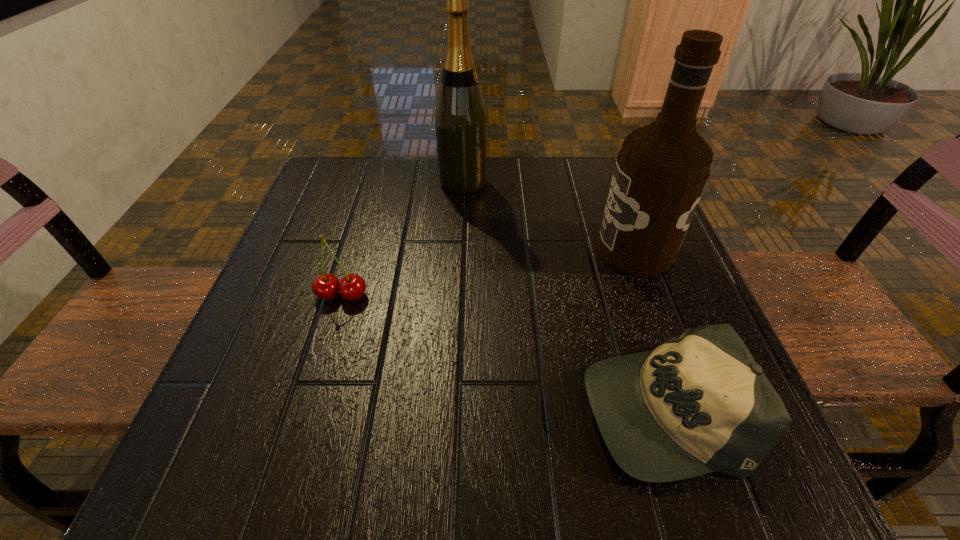
Image resolution: width=960 pixels, height=540 pixels. In order to click on empty location between the second farthest object and the baseball cap in this screenshot , I will do [648, 328].

Where is `blank region between the third object from right to left and the cherry`? The width and height of the screenshot is (960, 540). blank region between the third object from right to left and the cherry is located at coordinates (402, 239).

Where is `vacant region between the wine bottle and the third farthest object`? The width and height of the screenshot is (960, 540). vacant region between the wine bottle and the third farthest object is located at coordinates (402, 239).

Locate an element on the screen. This screenshot has height=540, width=960. free space between the second object from left to right and the alcohol is located at coordinates pyautogui.click(x=549, y=216).

At what (x,y) coordinates should I click in order to perform the action: click on vacant space that's between the second object from left to right and the third farthest object. Please return your answer as a coordinate pair (x, y). Looking at the image, I should click on [402, 239].

Locate which object ranks third in proximity to the second farthest object. Please provide its 2D coordinates. Your answer should be formatted as a tuple, i.e. [(x, y)], where the tuple contains the x and y coordinates of a point satisfying the conditions above.

[(326, 286)]

This screenshot has width=960, height=540. In order to click on the second closest object to the leftmost object in this screenshot , I will do `click(699, 403)`.

Identify the location of free space that satisfies the following two spatial constraints: 1. on the label of the alcohol; 2. with the stems of the leftmost object pointing upwards. Image resolution: width=960 pixels, height=540 pixels. (652, 295).

Where is `free region that satisfies the following two spatial constraints: 1. on the label of the alcohol; 2. with the stems of the leftmost object pointing upwards`? free region that satisfies the following two spatial constraints: 1. on the label of the alcohol; 2. with the stems of the leftmost object pointing upwards is located at coordinates (652, 295).

Locate an element on the screen. Image resolution: width=960 pixels, height=540 pixels. free space that satisfies the following two spatial constraints: 1. on the label of the alcohol; 2. with the stems of the leftmost object pointing upwards is located at coordinates (652, 295).